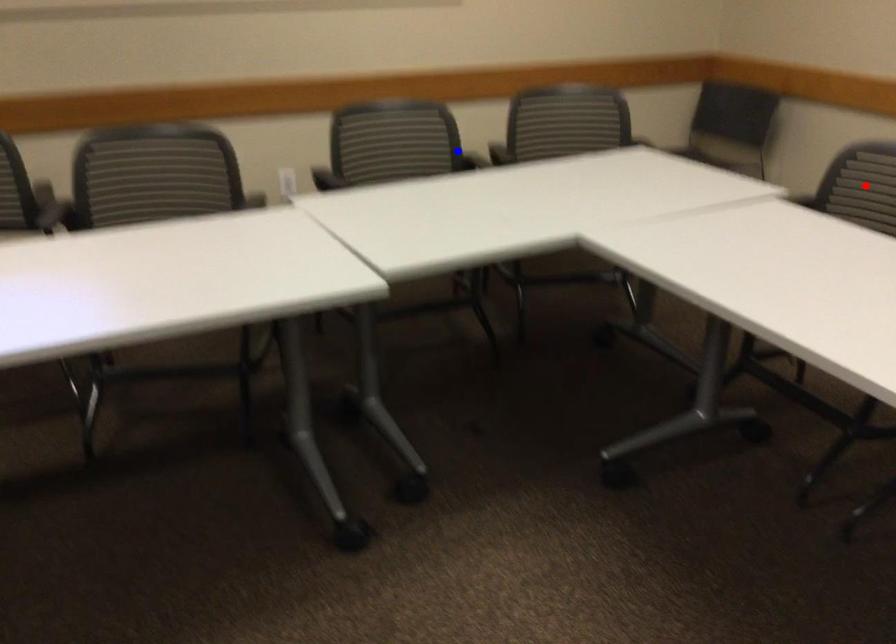
Question: Which of the two points in the image is closer to the camera?

Choices:
 (A) Blue point is closer.
 (B) Red point is closer.

Answer: (B)